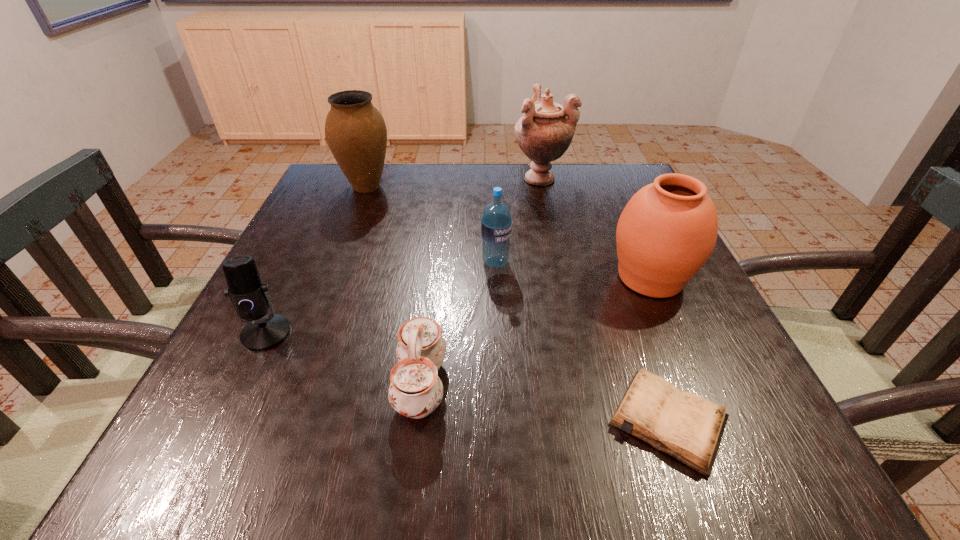
At what (x,y) coordinates should I click in order to perform the action: click on the second urn from left to right. Please return your answer as a coordinate pair (x, y). This screenshot has height=540, width=960. Looking at the image, I should click on tap(545, 131).

At what (x,y) coordinates should I click in order to perform the action: click on the leftmost urn. Please return your answer as a coordinate pair (x, y). The image size is (960, 540). Looking at the image, I should click on (356, 133).

Where is `the nearest urn`? The height and width of the screenshot is (540, 960). the nearest urn is located at coordinates (667, 231).

This screenshot has height=540, width=960. Identify the location of the fourth object from right to left. (496, 225).

Where is `microphone`? The image size is (960, 540). microphone is located at coordinates (250, 297).

Where is `chinaware`? This screenshot has width=960, height=540. chinaware is located at coordinates (415, 391).

Identify the location of the sixth tallest object. The height and width of the screenshot is (540, 960). (415, 391).

Find the location of a particular element. This screenshot has height=540, width=960. diary is located at coordinates (688, 427).

The width and height of the screenshot is (960, 540). I want to click on free space located 0.260m on the front of the second urn from left to right, so click(557, 253).

Locate an element on the screen. vacant space located on the right of the leftmost urn is located at coordinates (435, 186).